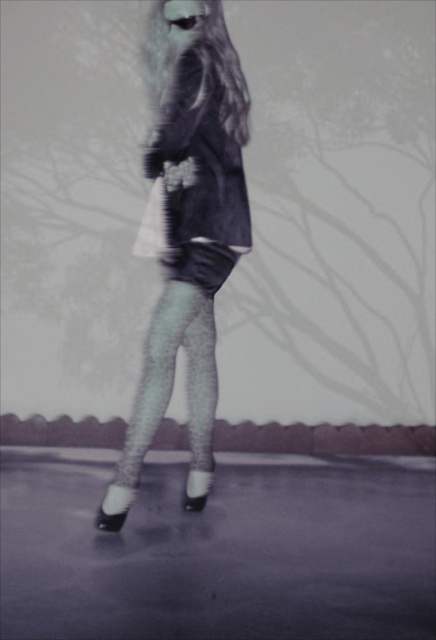
You are a fashion designer analyzing the image. The client wants to know if the fuzzy black dress at center is layered over the glittery tights at center. Based on the spatial relationship between these two items, can you confirm this?

The fuzzy black dress at center is above glittery tights at center, so yes, the fuzzy black dress at center is layered over the glittery tights at center.

You are a fashion designer trying to create a cohesive outfit. Given the fluffy black coat at center and the glittery tights at center, which item would you adjust in size to ensure they complement each other better?

The fluffy black coat at center is larger than the glittery tights at center. To ensure they complement each other better, you could consider resizing the glittery tights at center to match the scale of the coat or adjust the coat to be slightly smaller so both items are proportionate.

You are a fashion designer who wants to create a new outfit based on the image. Given that the fluffy black coat at center is much taller than the glittery tights at center, how would you adjust the coat to make it proportionate to the tights?

Since the fluffy black coat at center is much taller than the glittery tights at center, I would shorten the coat to match the height of the tights to achieve a more balanced look.